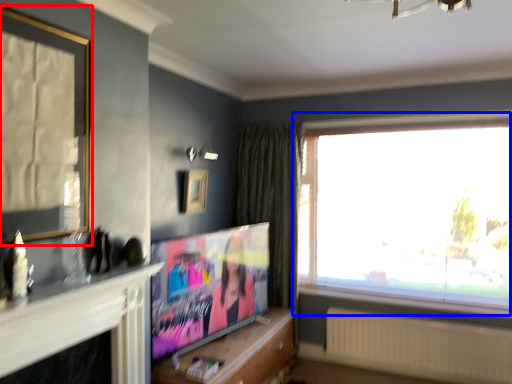
Question: Which point is further to the camera, picture frame (highlighted by a red box) or window (highlighted by a blue box)?

Choices:
 (A) picture frame
 (B) window

Answer: (B)